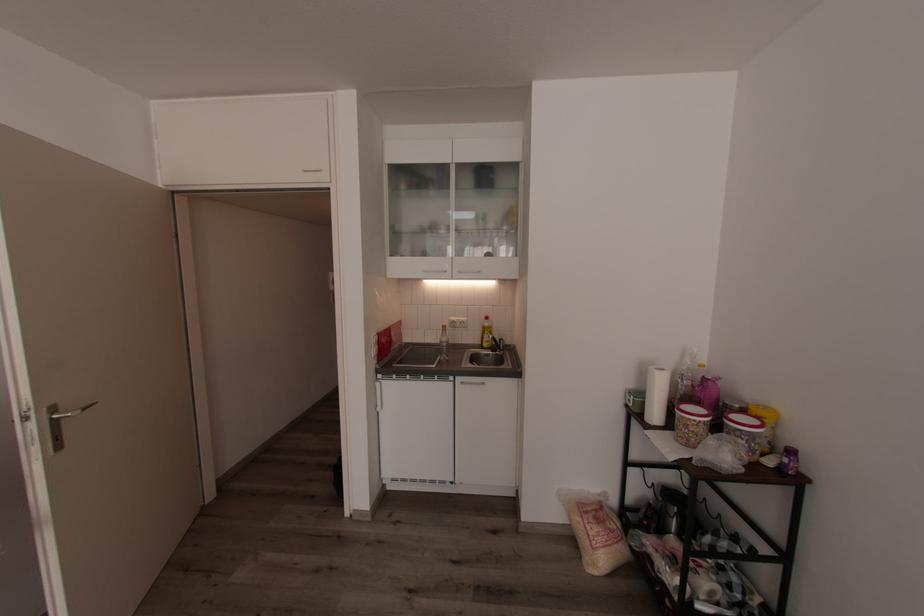
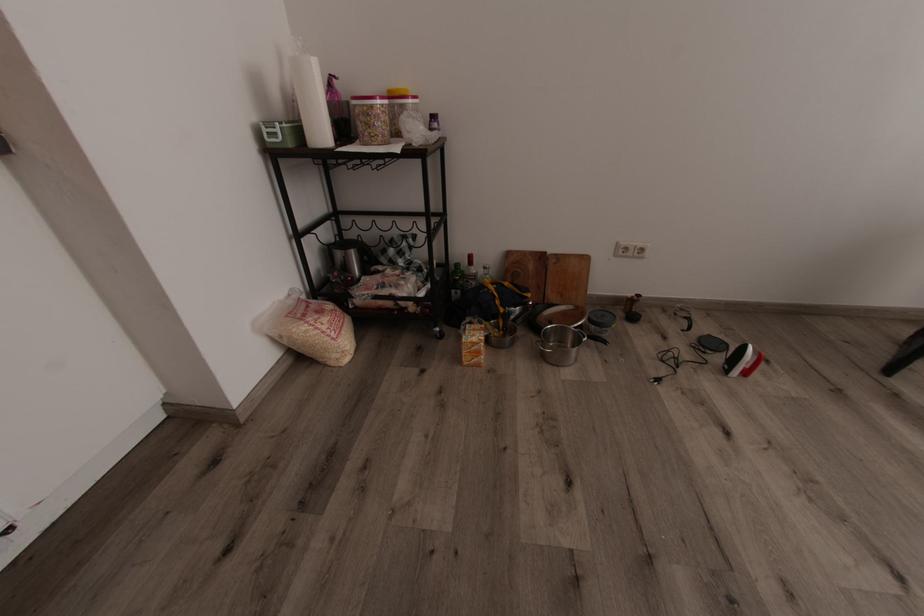
Find the pixel in the second image that matches the point at 690,426 in the first image.

(382, 116)